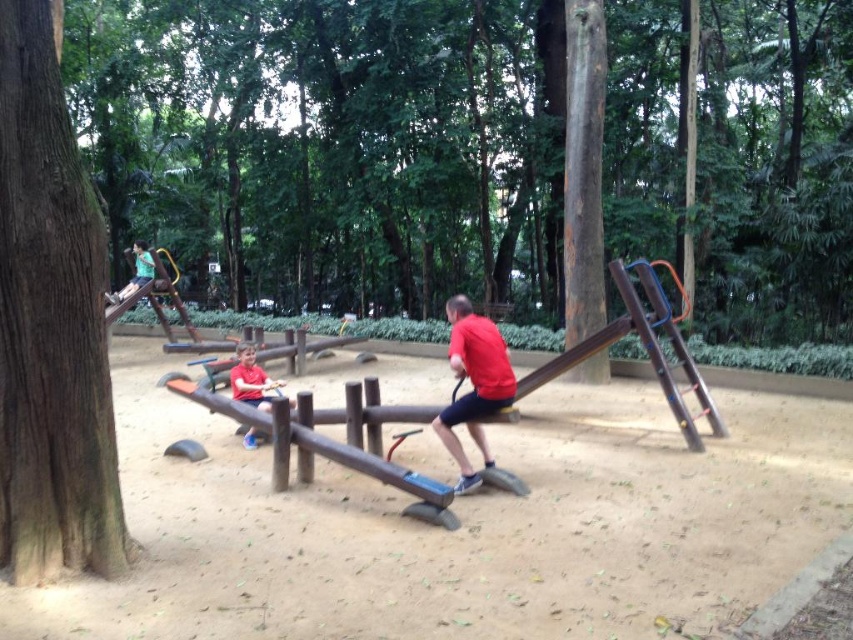
Can you confirm if red matte shirt at center is smaller than matte red shirt at center?

Incorrect, red matte shirt at center is not smaller in size than matte red shirt at center.

Does red matte shirt at center appear over matte red shirt at center?

Yes.

Is point (451, 316) farther from camera compared to point (256, 368)?

No, (451, 316) is closer to viewer.

Locate an element on the screen. Image resolution: width=853 pixels, height=640 pixels. red matte shirt at center is located at coordinates (473, 385).